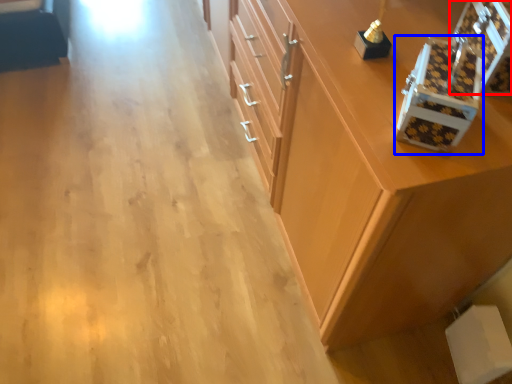
Question: Which object is closer to the camera taking this photo, box (highlighted by a red box) or box (highlighted by a blue box)?

Choices:
 (A) box
 (B) box

Answer: (B)